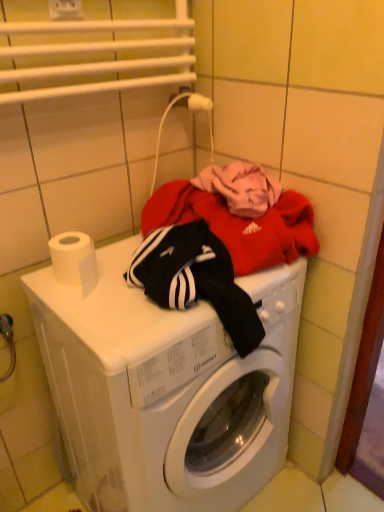
You are a GUI agent. You are given a task and a screenshot of the screen. Output one action in this format:
    pyautogui.click(x=<x>, y=<y>)
    Task: Click on the vacant space to the right of white matte toilet paper at upper left
    The height and width of the screenshot is (512, 384).
    Given the screenshot: What is the action you would take?
    pyautogui.click(x=139, y=298)